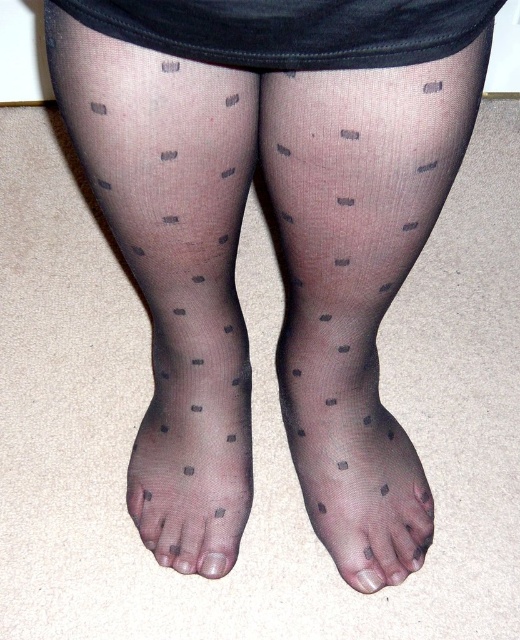
You are standing in a room and see the image. There is a point marked at coordinates (351, 444). What object in the image is located at that point?

The transparent sheer tights at lower center are located at point (351, 444).

You are a fashion designer observing the image. You need to determine the spatial arrangement of the transparent sheer tights at center and the transparent nylon toe at center. Which one is located to the left?

The transparent sheer tights at center is positioned on the left side of transparent nylon toe at center, so the transparent sheer tights at center is on the left.

You are a fashion designer trying to create a new pattern for the transparent sheer tights at lower center and transparent nylon toe at center. Which one of these items has a bigger surface area that you can work with?

The transparent sheer tights at lower center has a larger surface area than the transparent nylon toe at center, so you can work with a bigger area on the transparent sheer tights at lower center.